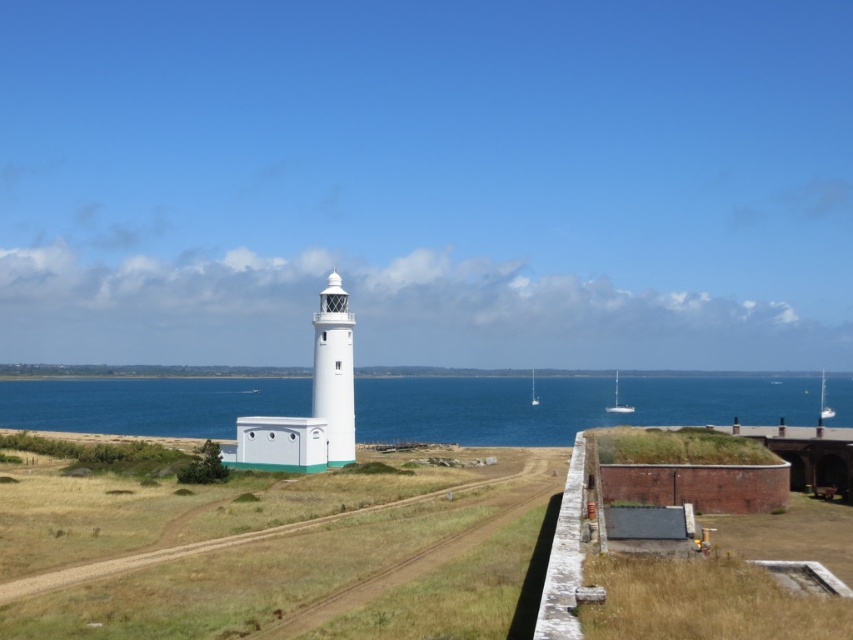
You are a photographer planning to take a picture of the white smooth lighthouse at center and the white glossy sailboat at right. From your current position, which object will appear closer to the top of the photo?

The white smooth lighthouse at center appears closer to the top of the photo because it is positioned over the white glossy sailboat at right.

Based on the photo, you are a photographer planning to capture the white smooth lighthouse at center and the dry grass at center in a single frame. Based on their widths, which object should you focus on to ensure both are fully visible in the shot?

The dry grass at center might be wider than the white smooth lighthouse at center, so focusing on the wider dry grass at center would ensure both objects are fully visible in the frame.

You are standing at the starting point of the dirt path leading to the lighthouse. You want to walk towards the point marked at coordinates point (132, 513). How far will you have to walk to reach that point?

The point (132, 513) is 53.22 meters from the viewer, so you will have to walk 53.22 meters to reach it.